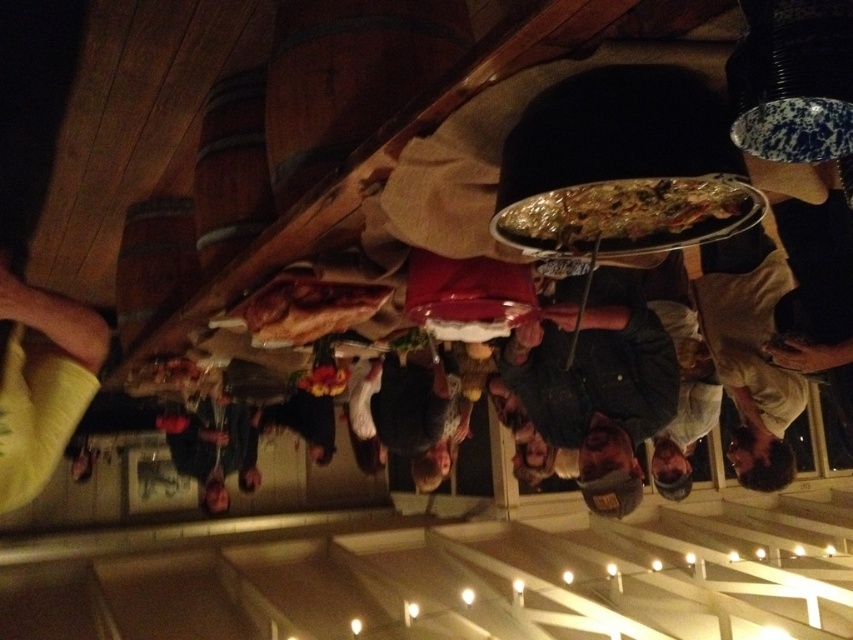
You are at a party and want to grab the shiny metallic pizza at center. However, there is a person wearing a white cotton shirt at center in the way. Can you reach the pizza without moving the person?

The white cotton shirt at center is positioned under the shiny metallic pizza at center, meaning the pizza is above the person. You can reach the pizza without moving the person since it is above them.

You are at a party and need to locate the white cotton shirt at center and the yellow fabric at lower left. Which one is positioned to the right side of the other?

The white cotton shirt at center is to the right of yellow fabric at lower left.

From the picture: You are at a party and want to grab a slice of pizza from the pizza at center. The pizza is placed on a round table. There is a point marked at coordinate (x=630, y=216) on the pizza. If you stand at the edge of the table, which direction should you move to reach the point on the pizza?

The point at coordinate (x=630, y=216) on the shiny metallic pizza at center is located at the center of the pizza. Therefore, you should move towards the center of the pizza to reach the point.